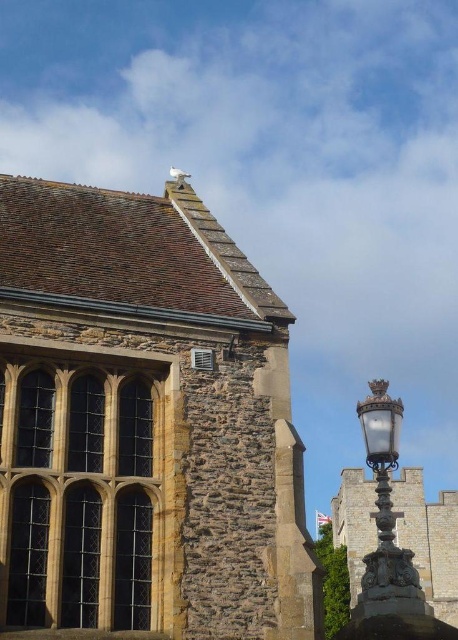
Question: Does brown stone church at upper left come behind polished brass lamp post at right?

Choices:
 (A) yes
 (B) no

Answer: (A)

Question: In this image, where is brown stone church at upper left located relative to polished brass lamp post at right?

Choices:
 (A) below
 (B) above

Answer: (B)

Question: Which of the following is the farthest from the observer?

Choices:
 (A) (186, 212)
 (B) (365, 584)

Answer: (A)

Question: Does brown stone church at upper left appear under polished brass lamp post at right?

Choices:
 (A) yes
 (B) no

Answer: (B)

Question: Which point appears closest to the camera in this image?

Choices:
 (A) (379, 451)
 (B) (112, 554)

Answer: (A)

Question: Which point is closer to the camera taking this photo?

Choices:
 (A) (394, 554)
 (B) (287, 396)

Answer: (A)